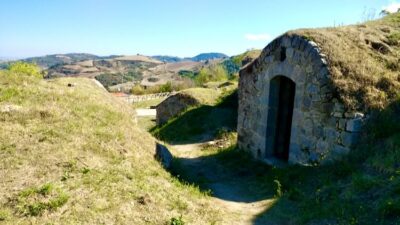
In order to click on window in this screenshot , I will do `click(282, 56)`.